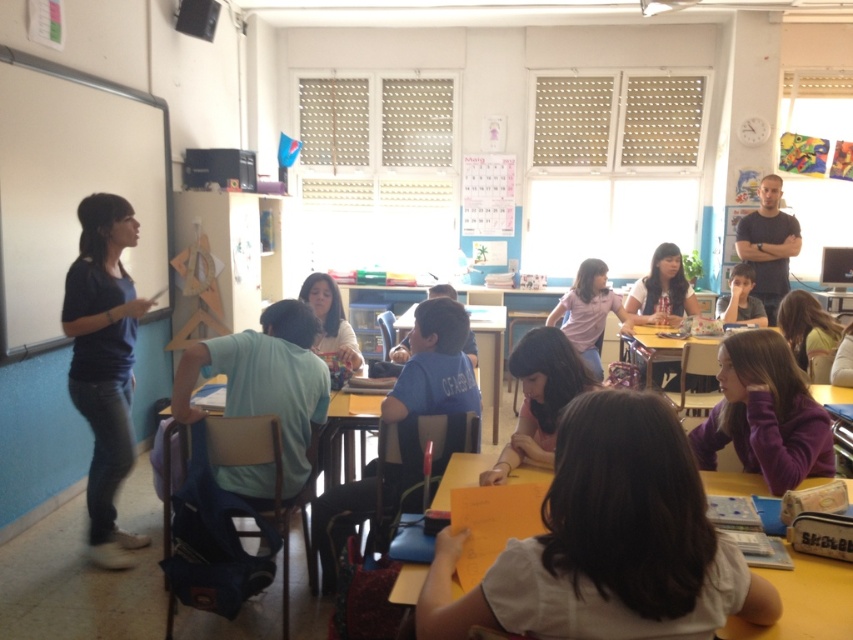
Question: Which is nearer to the white matte board at left?

Choices:
 (A) smooth pink shirt at center
 (B) matte blue shirt at center

Answer: (A)

Question: Which object is positioned farthest from the smooth pink shirt at center?

Choices:
 (A) black t-shirt at upper right
 (B) matte blue shirt at center

Answer: (A)

Question: Can you confirm if white matte board at left is positioned to the right of black t-shirt at upper right?

Choices:
 (A) no
 (B) yes

Answer: (A)

Question: Considering the relative positions of yellow matte table at center and smooth pink shirt at center in the image provided, where is yellow matte table at center located with respect to smooth pink shirt at center?

Choices:
 (A) above
 (B) below

Answer: (B)

Question: Which of these objects is positioned farthest from the white matte board at left?

Choices:
 (A) black t-shirt at upper right
 (B) yellow matte table at center

Answer: (A)

Question: Considering the relative positions of smooth pink shirt at center and black t-shirt at upper right in the image provided, where is smooth pink shirt at center located with respect to black t-shirt at upper right?

Choices:
 (A) right
 (B) left

Answer: (B)